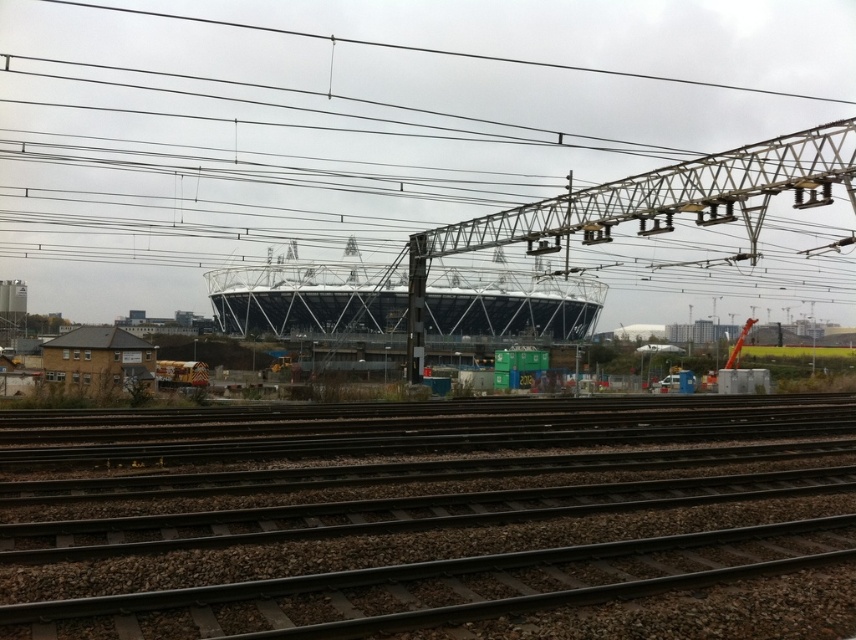
Between metallic wire at center and black metal train tracks at lower center, which one appears on the right side from the viewer's perspective?

From the viewer's perspective, black metal train tracks at lower center appears more on the right side.

Can you confirm if metallic wire at center is shorter than black metal train tracks at lower center?

No, metallic wire at center is not shorter than black metal train tracks at lower center.

You are a GUI agent. You are given a task and a screenshot of the screen. Output one action in this format:
    pyautogui.click(x=<x>, y=<y>)
    Task: Click on the metallic wire at center
    This screenshot has width=856, height=640.
    Given the screenshot: What is the action you would take?
    pyautogui.click(x=360, y=120)